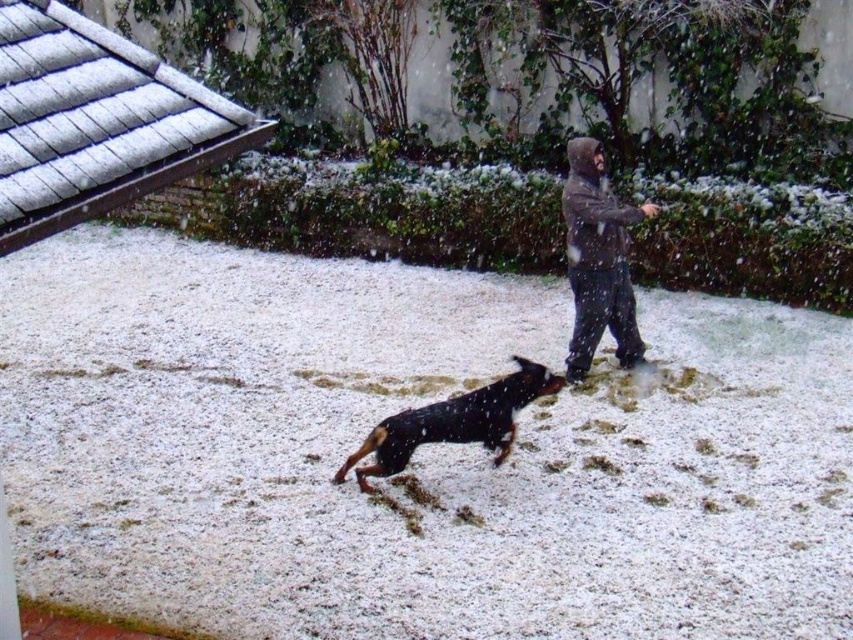
You are standing in the snowy scene and want to throw a snowball at the dark gray hoodie at center. If your aim is perfect, where should you aim in terms of coordinates?

You should aim at the coordinates point [598,259] to hit the dark gray hoodie at center.

You are a photographer trying to capture the dog in the snow. You notice the dark gray hoodie at center and the black and tan fur dog at center. Which object is covering the other one in the image?

The dark gray hoodie at center is positioned over black and tan fur dog at center, so the hoodie is covering the dog in the image.

You are a photographer trying to capture the perfect shot of the black and tan fur dog at center and the white fluffy snow at center. Based on their positions, which object is higher in the image?

The white fluffy snow at center is much taller than the black and tan fur dog at center, so the white fluffy snow at center is higher in the image.